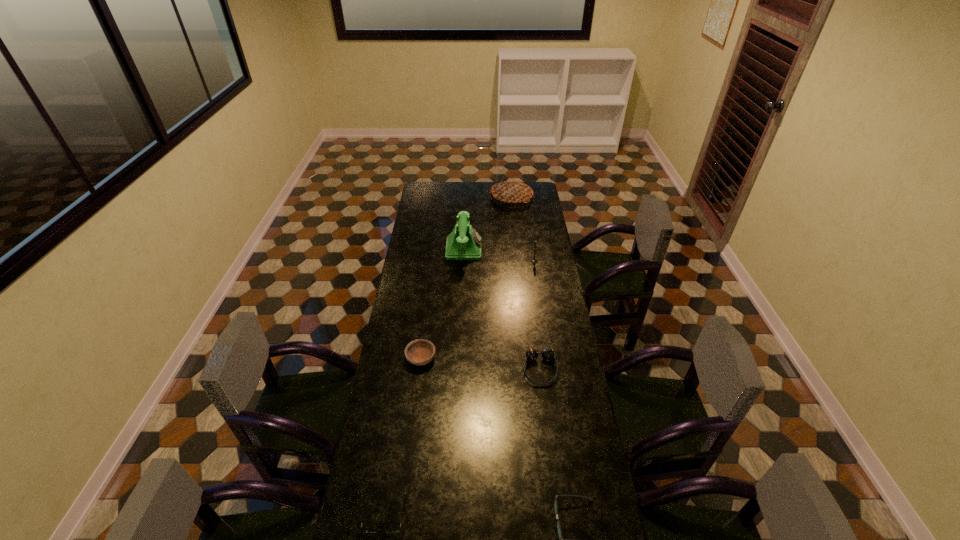
Where is `blank space located through the lenses of the fourth shortest object`? blank space located through the lenses of the fourth shortest object is located at coordinates (549, 443).

Find the location of a particular element. vacant space located on the front of the bowl is located at coordinates (410, 441).

The width and height of the screenshot is (960, 540). Identify the location of object that is at the far edge. (512, 191).

The height and width of the screenshot is (540, 960). Find the location of `bowl located at the left edge`. bowl located at the left edge is located at coordinates (419, 352).

Where is `spectacles located at the left edge`? spectacles located at the left edge is located at coordinates click(x=364, y=529).

Where is `pie at the right edge`? pie at the right edge is located at coordinates (512, 191).

The image size is (960, 540). I want to click on candle that is positioned at the right edge, so click(533, 260).

In order to click on goggles present at the right edge in this screenshot , I will do `click(548, 354)`.

Find the location of a particular element. This screenshot has height=540, width=960. object that is positioned at the far right corner is located at coordinates (512, 191).

Locate an element on the screen. blank space at the left edge of the desktop is located at coordinates (422, 266).